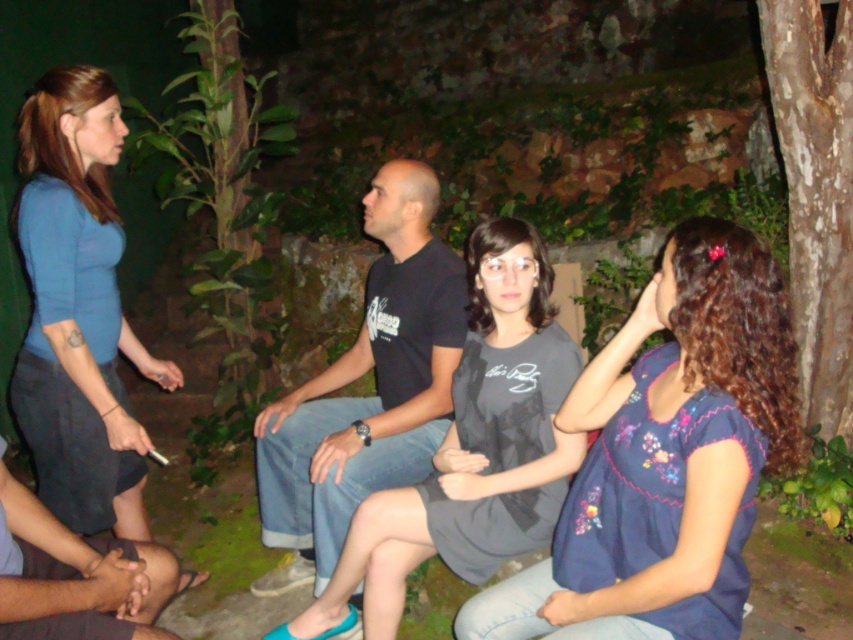
The width and height of the screenshot is (853, 640). Describe the element at coordinates (78, 308) in the screenshot. I see `blue fabric shirt at left` at that location.

Which of these two, blue fabric shirt at left or smooth black hands at lower left, stands shorter?

smooth black hands at lower left is shorter.

Image resolution: width=853 pixels, height=640 pixels. In order to click on blue fabric shirt at left in this screenshot , I will do `click(78, 308)`.

Find the location of `blue fabric shirt at left`. blue fabric shirt at left is located at coordinates (78, 308).

Does point (338, 529) lie behind point (16, 572)?

Yes, it is.

Is black cotton shirt at center smaller than smooth black hands at lower left?

Actually, black cotton shirt at center might be larger than smooth black hands at lower left.

Is point (373, 445) behind point (16, 513)?

That is True.

Find the location of a particular element. black cotton shirt at center is located at coordinates (366, 397).

Who is more forward, (x=653, y=321) or (x=329, y=448)?

Point (x=653, y=321)

Is blue embroidered blouse at center smaller than black cotton shirt at center?

Correct, blue embroidered blouse at center occupies less space than black cotton shirt at center.

Where is `blue embroidered blouse at center`? The image size is (853, 640). blue embroidered blouse at center is located at coordinates (666, 458).